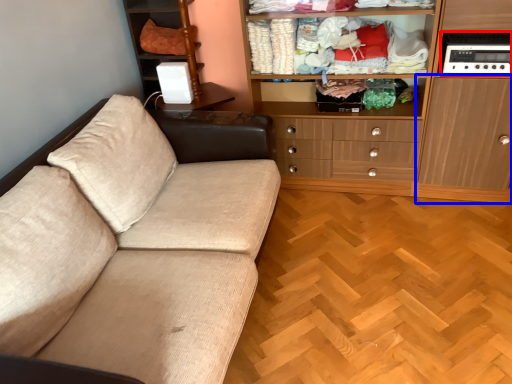
Question: Which point is further to the camera, appliance (highlighted by a red box) or cabinetry (highlighted by a blue box)?

Choices:
 (A) appliance
 (B) cabinetry

Answer: (A)